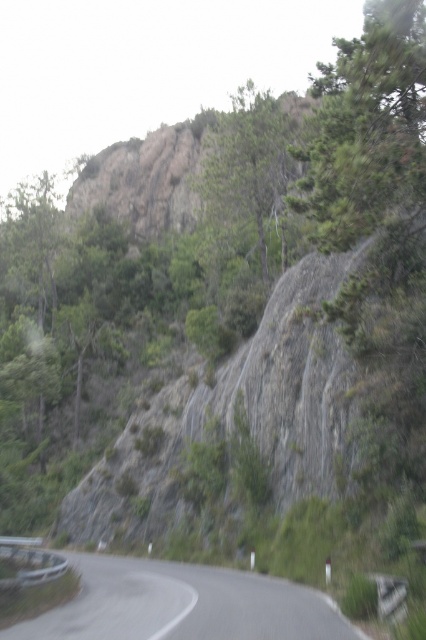
You are a hiker standing at the start of the winding road. You notice a green textured tree at upper right. Based on its position, can you determine if it is closer to the road or the cliff face?

The green textured tree at upper right is located at point (x=367, y=128), which places it closer to the road than the cliff face.

You are a hiker standing at the starting point of the gray asphalt road at lower center. You notice the green leafy tree at upper center in the distance. Which object is closer to your current position?

The gray asphalt road at lower center is closer to your current position because it is shorter than the green leafy tree at upper center.

You are a hiker standing on the road and see a point marked at coordinates (367, 128). Based on the scene, can you determine what object this point is located on?

The point is located on the green textured tree at upper right.